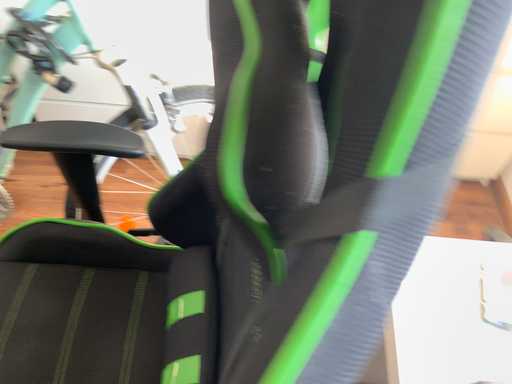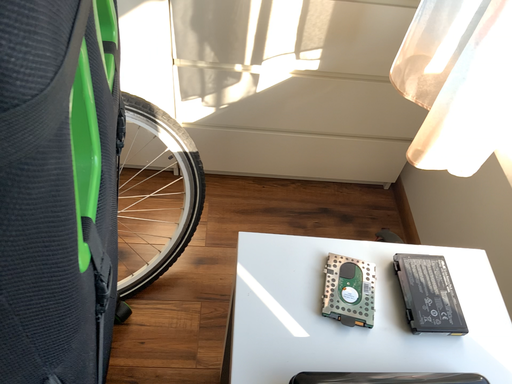
Question: How did the camera likely rotate when shooting the video?

Choices:
 (A) rotated left
 (B) rotated right

Answer: (B)